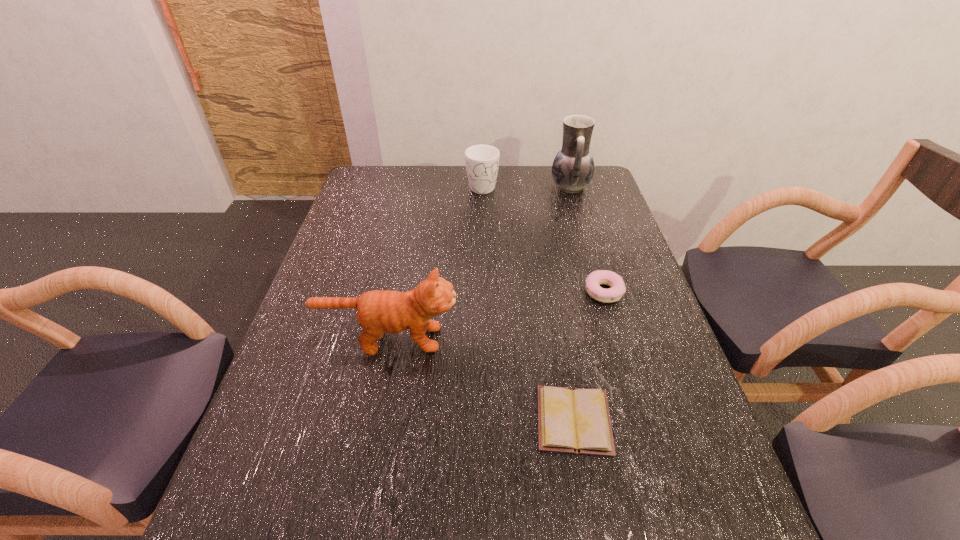
Where is `vacant region that satisfies the following two spatial constraints: 1. on the side of the third shortest object with the handle; 2. on the face of the fourth shortest object`? vacant region that satisfies the following two spatial constraints: 1. on the side of the third shortest object with the handle; 2. on the face of the fourth shortest object is located at coordinates (483, 339).

Locate an element on the screen. free space that satisfies the following two spatial constraints: 1. on the front side of the third nearest object; 2. on the face of the leftmost object is located at coordinates (617, 339).

Locate an element on the screen. The image size is (960, 540). vacant space that satisfies the following two spatial constraints: 1. on the side of the third farthest object with the handle; 2. on the left side of the mug is located at coordinates (483, 292).

The image size is (960, 540). Find the location of `free location that satisfies the following two spatial constraints: 1. on the front-facing side of the third nearest object; 2. on the left side of the tallest object`. free location that satisfies the following two spatial constraints: 1. on the front-facing side of the third nearest object; 2. on the left side of the tallest object is located at coordinates click(601, 292).